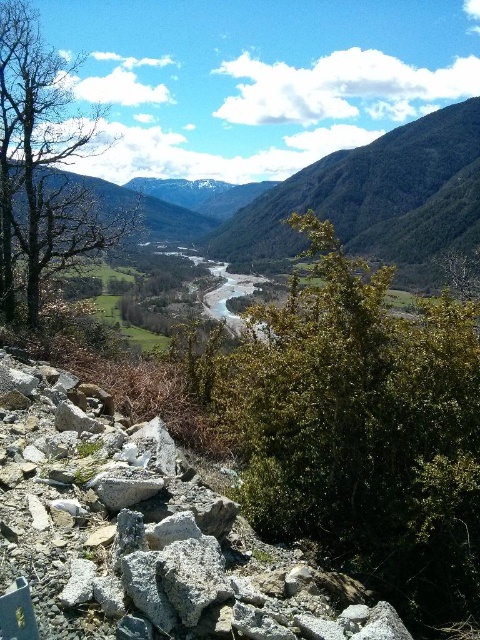
You are standing at the point marked as point (141, 536) in the image. Looking around, you see a gray rough rock at lower left. What is the nearest object to you in this valley scene?

The nearest object to you at point (141, 536) is the gray rough rock at lower left because the point corresponds to its location.

You are standing at the camera position looking at the valley. There are two points marked in the image, one at point (111, 540) and another at point (420, 220). Which point is nearer to you?

Point (111, 540) is closer to the camera than point (420, 220).

Based on the photo, you are an explorer navigating the valley and need to cross the river. You see a gray rough rock at lower left and a bare wood tree at left. Which object is closer to the river?

The gray rough rock at lower left is to the right of the bare wood tree at left, so the bare wood tree at left is closer to the river.